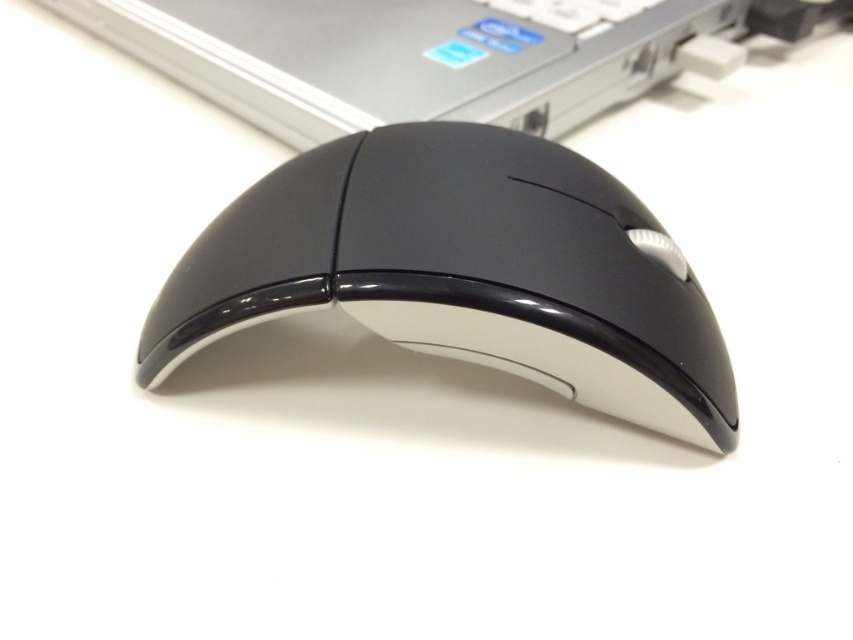
Locate an element on the screen. The image size is (853, 640). black glossy mouse at upper center is located at coordinates (415, 56).

Does point (346, 8) lie behind point (608, 6)?

Yes, point (346, 8) is farther from viewer.

Describe the element at coordinates (415, 56) in the screenshot. I see `black glossy mouse at upper center` at that location.

Where is `black glossy mouse at upper center`? The width and height of the screenshot is (853, 640). black glossy mouse at upper center is located at coordinates (415, 56).

Is point (643, 268) positioned after point (531, 16)?

No, it is in front of (531, 16).

Does point (265, 230) come in front of point (587, 13)?

Yes, point (265, 230) is closer to viewer.

Image resolution: width=853 pixels, height=640 pixels. I want to click on black glossy mouse at center, so click(x=463, y=272).

Who is more distant from viewer, (341, 220) or (448, 93)?

The point (448, 93) is behind.

Which is more to the left, black glossy mouse at center or black glossy mouse at upper center?

Positioned to the left is black glossy mouse at upper center.

Identify the location of black glossy mouse at center. (463, 272).

This screenshot has height=640, width=853. What are the coordinates of `black glossy mouse at center` in the screenshot? It's located at (463, 272).